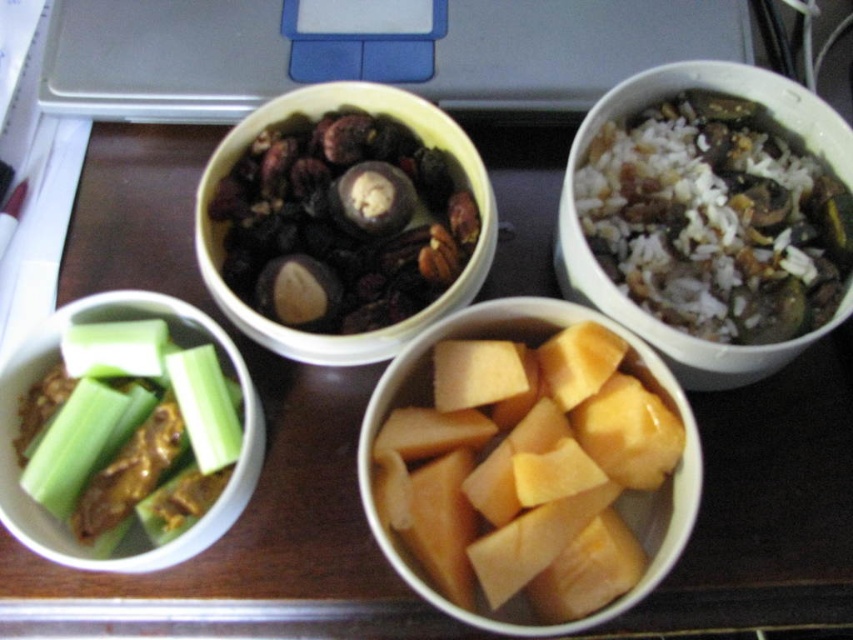
Consider the image. Which is more to the right, yellowish matte pumpkin at center or green matte celery at lower left?

yellowish matte pumpkin at center

Which is more to the left, yellowish matte pumpkin at center or green matte celery at lower left?

green matte celery at lower left

The width and height of the screenshot is (853, 640). I want to click on yellowish matte pumpkin at center, so click(x=616, y=500).

Where is `yellowish matte pumpkin at center`? The width and height of the screenshot is (853, 640). yellowish matte pumpkin at center is located at coordinates (616, 500).

Which of these two, yellowish matte pumpkin at center or white rice with vegetables at upper right, stands taller?

white rice with vegetables at upper right

Does point (651, 376) lie behind point (726, 376)?

No, it is in front of (726, 376).

Identify the location of yellowish matte pumpkin at center. (616, 500).

Between white rice with vegetables at upper right and green matte celery at lower left, which one is positioned higher?

white rice with vegetables at upper right

Is white rice with vegetables at upper right to the right of green matte celery at lower left from the viewer's perspective?

Correct, you'll find white rice with vegetables at upper right to the right of green matte celery at lower left.

Locate an element on the screen. This screenshot has width=853, height=640. white rice with vegetables at upper right is located at coordinates (608, 278).

This screenshot has height=640, width=853. Find the location of `white rice with vegetables at upper right`. white rice with vegetables at upper right is located at coordinates (608, 278).